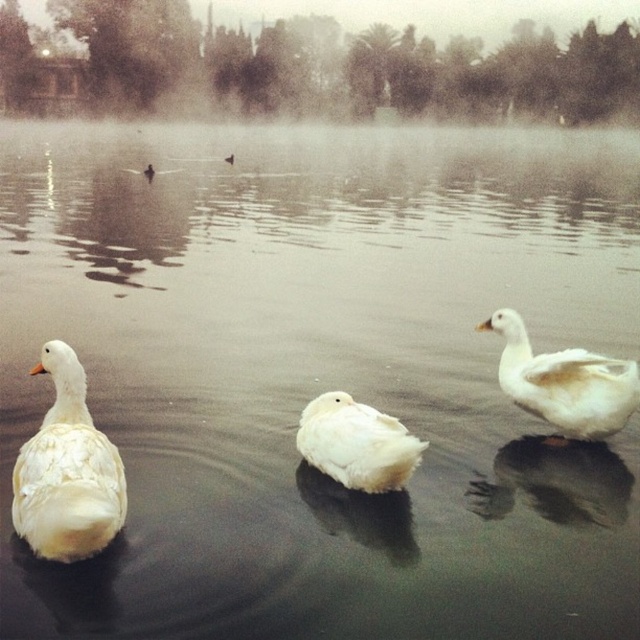
You are standing at the edge of the pond and want to throw a pebble to hit both point (x=20, y=522) and point (x=600, y=420). Which point should you aim for first to hit them in order from closest to farthest?

You should aim for point (x=20, y=522) first because it is closer to you than point (x=600, y=420), so you can hit them in order from closest to farthest.

You are standing at the center of the image and want to walk towards the point marked at coordinate point (x=67, y=472). Which direction should you go?

The point (x=67, y=472) is on the white fluffy goose at left, so you should go to the left to reach it.